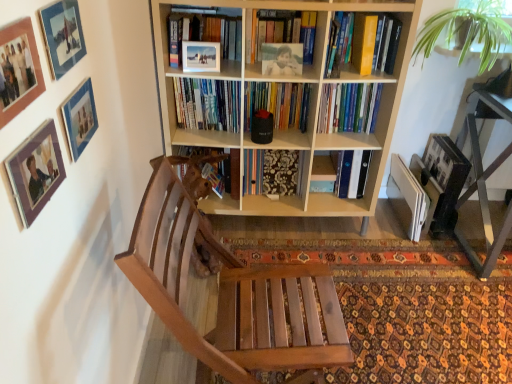
Question: Is the surface of wooden chair at center in direct contact with matte glass picture frame at upper left, the 1th picture frame viewed from the top?

Choices:
 (A) no
 (B) yes

Answer: (A)

Question: From a real-world perspective, does wooden chair at center stand above matte glass picture frame at upper left, the 1th picture frame viewed from the top?

Choices:
 (A) yes
 (B) no

Answer: (B)

Question: Does wooden chair at center have a lesser height compared to matte glass picture frame at upper left, the 1th picture frame viewed from the top?

Choices:
 (A) no
 (B) yes

Answer: (A)

Question: Can you confirm if wooden chair at center is thinner than matte glass picture frame at upper left, arranged as the 4th picture frame when ordered from the bottom?

Choices:
 (A) no
 (B) yes

Answer: (A)

Question: Is matte glass picture frame at upper left, the 1th picture frame viewed from the top, located within wooden chair at center?

Choices:
 (A) no
 (B) yes

Answer: (A)

Question: Is hardcover books at center, the 1th book in the bottom-to-top sequence, situated inside light wood bookcase at center or outside?

Choices:
 (A) inside
 (B) outside

Answer: (A)

Question: Considering the positions of hardcover books at center, the 1th book in the bottom-to-top sequence, and light wood bookcase at center in the image, is hardcover books at center, the 1th book in the bottom-to-top sequence, bigger or smaller than light wood bookcase at center?

Choices:
 (A) small
 (B) big

Answer: (A)

Question: From a real-world perspective, relative to light wood bookcase at center, is hardcover books at center, the 1th book in the bottom-to-top sequence, vertically above or below?

Choices:
 (A) above
 (B) below

Answer: (A)

Question: In the image, is hardcover books at center, the 1th book in the bottom-to-top sequence, positioned in front of or behind light wood bookcase at center?

Choices:
 (A) behind
 (B) front

Answer: (A)

Question: From a real-world perspective, is matte glass picture frame at upper left, arranged as the 4th picture frame when ordered from the bottom, above or below wooden picture frame at upper left, marked as the 4th picture frame in a top-to-bottom arrangement?

Choices:
 (A) below
 (B) above

Answer: (B)

Question: In terms of height, does matte glass picture frame at upper left, the 1th picture frame viewed from the top, look taller or shorter compared to wooden picture frame at upper left, arranged as the first picture frame when ordered from the bottom?

Choices:
 (A) tall
 (B) short

Answer: (B)

Question: Considering their positions, is matte glass picture frame at upper left, the 1th picture frame viewed from the top, located in front of or behind wooden picture frame at upper left, marked as the 4th picture frame in a top-to-bottom arrangement?

Choices:
 (A) front
 (B) behind

Answer: (B)

Question: Is matte glass picture frame at upper left, arranged as the 4th picture frame when ordered from the bottom, inside or outside of wooden picture frame at upper left, marked as the 4th picture frame in a top-to-bottom arrangement?

Choices:
 (A) inside
 (B) outside

Answer: (B)

Question: Is hardcover books at center, the 1th book in the bottom-to-top sequence, inside or outside of yellow hardcover book at upper right, the second book positioned from the bottom?

Choices:
 (A) inside
 (B) outside

Answer: (B)

Question: From the image's perspective, is hardcover books at center, the 1th book in the bottom-to-top sequence, positioned above or below yellow hardcover book at upper right, the second book positioned from the bottom?

Choices:
 (A) below
 (B) above

Answer: (A)